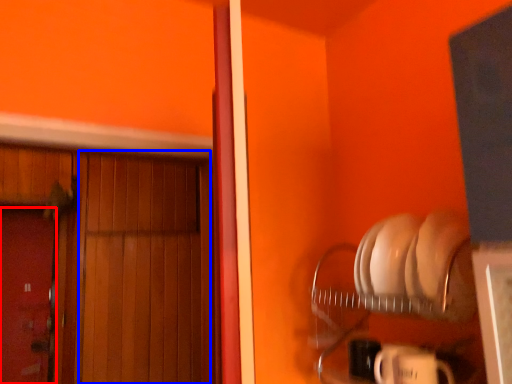
Question: Which point is further to the camera, door (highlighted by a red box) or door (highlighted by a blue box)?

Choices:
 (A) door
 (B) door

Answer: (A)